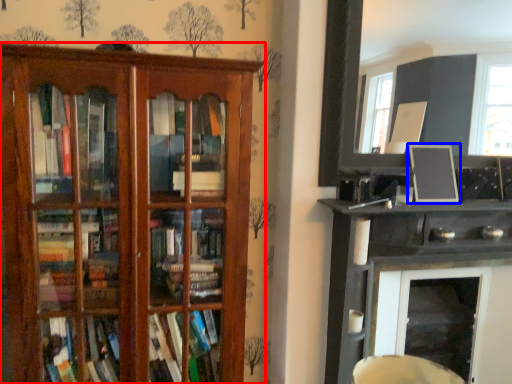
Question: Which point is closer to the camera, shelf (highlighted by a red box) or picture frame (highlighted by a blue box)?

Choices:
 (A) shelf
 (B) picture frame

Answer: (A)